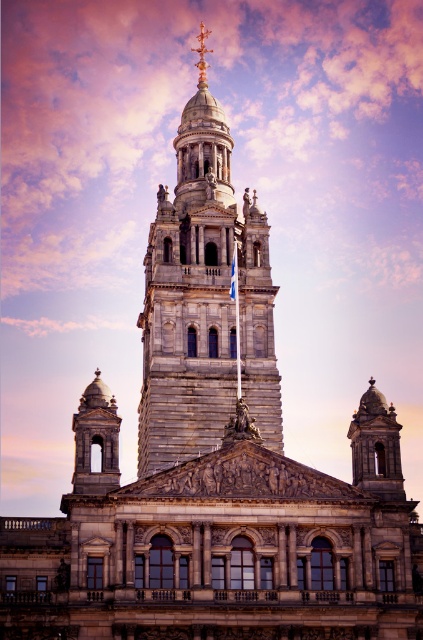
Question: Which object is farther from the camera taking this photo?

Choices:
 (A) smooth stone bell tower at left
 (B) stone tower at center

Answer: (B)

Question: Which object appears farthest from the camera in this image?

Choices:
 (A) smooth stone dome at upper center
 (B) stone tower at center
 (C) smooth stone bell tower at left

Answer: (B)

Question: Which object is positioned farthest from the smooth stone dome at upper center?

Choices:
 (A) stone tower at center
 (B) smooth stone bell tower at left

Answer: (A)

Question: Is smooth stone dome at upper center wider than smooth stone bell tower at left?

Choices:
 (A) yes
 (B) no

Answer: (B)

Question: Is stone tower at center to the left of smooth stone dome at upper center from the viewer's perspective?

Choices:
 (A) no
 (B) yes

Answer: (B)

Question: Does stone tower at center have a larger size compared to smooth stone bell tower at left?

Choices:
 (A) yes
 (B) no

Answer: (A)